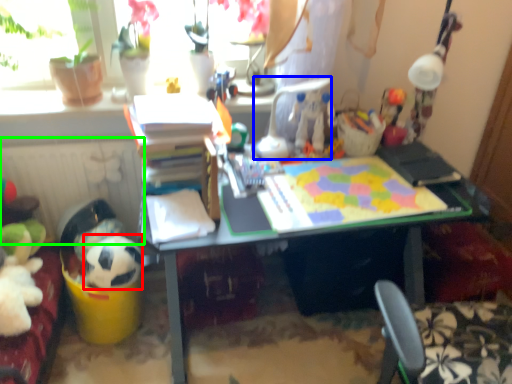
Question: Considering the real-world distances, which object is closest to animal (highlighted by a red box)? chair (highlighted by a blue box) or radiator (highlighted by a green box).

Choices:
 (A) chair
 (B) radiator

Answer: (B)